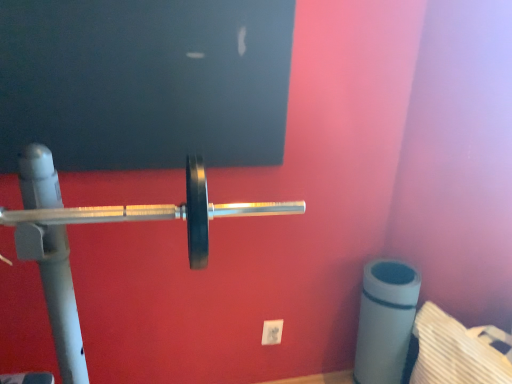
Question: In terms of height, does white plastic power plug/socket at lower center look taller or shorter compared to polished silver barbell at center?

Choices:
 (A) short
 (B) tall

Answer: (A)

Question: From a real-world perspective, is white plastic power plug/socket at lower center above or below polished silver barbell at center?

Choices:
 (A) above
 (B) below

Answer: (B)

Question: Is white plastic power plug/socket at lower center situated inside polished silver barbell at center or outside?

Choices:
 (A) inside
 (B) outside

Answer: (B)

Question: Considering their positions, is polished silver barbell at center located in front of or behind white plastic power plug/socket at lower center?

Choices:
 (A) front
 (B) behind

Answer: (A)

Question: Choose the correct answer: Is polished silver barbell at center inside white plastic power plug/socket at lower center or outside it?

Choices:
 (A) inside
 (B) outside

Answer: (B)

Question: Visually, is polished silver barbell at center positioned to the left or to the right of white plastic power plug/socket at lower center?

Choices:
 (A) right
 (B) left

Answer: (B)

Question: Based on their sizes in the image, would you say polished silver barbell at center is bigger or smaller than white plastic power plug/socket at lower center?

Choices:
 (A) small
 (B) big

Answer: (B)